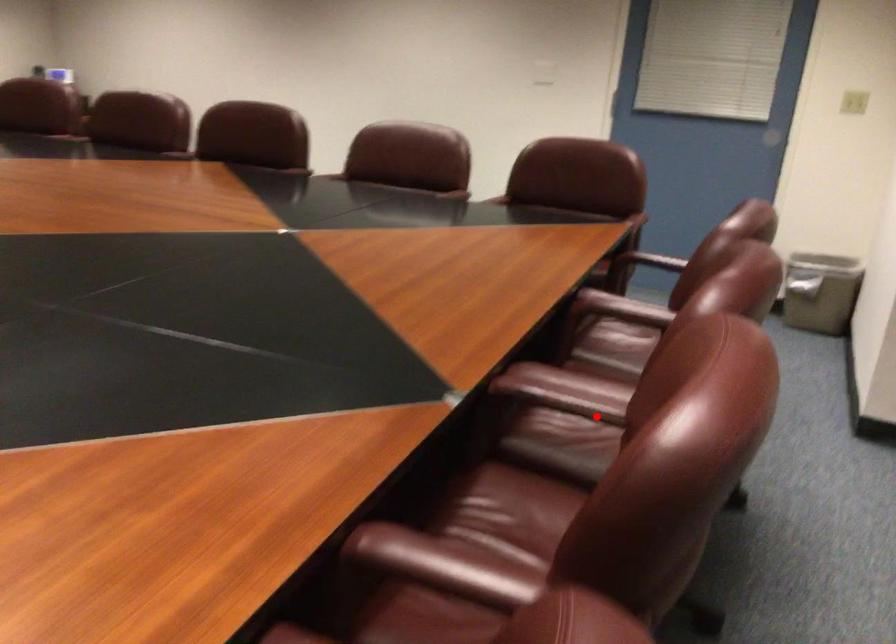
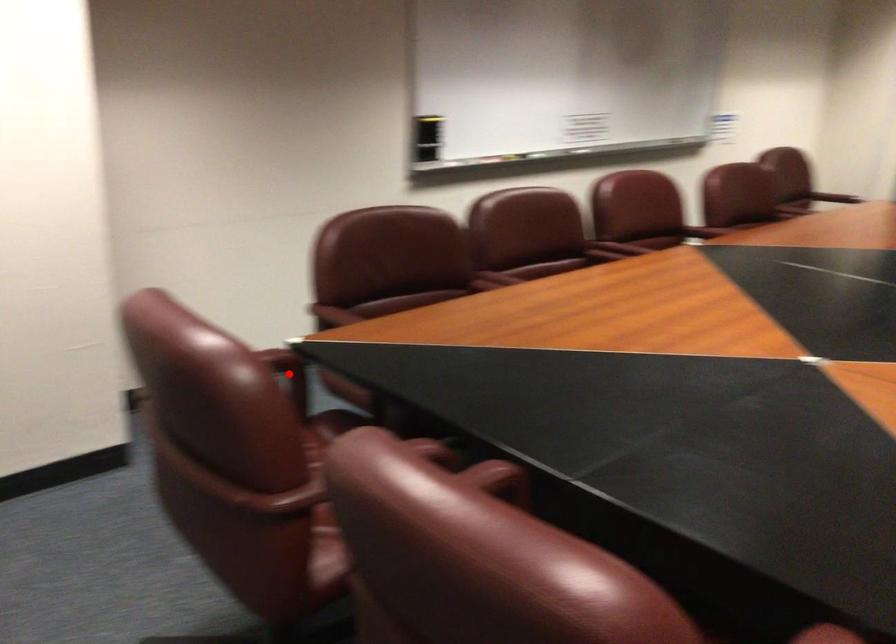
I am providing you with two images of the same scene from different viewpoints. A red point is marked on the first image and another point is marked on the second image. Does the point marked in image1 correspond to the same location as the one in image2?

No